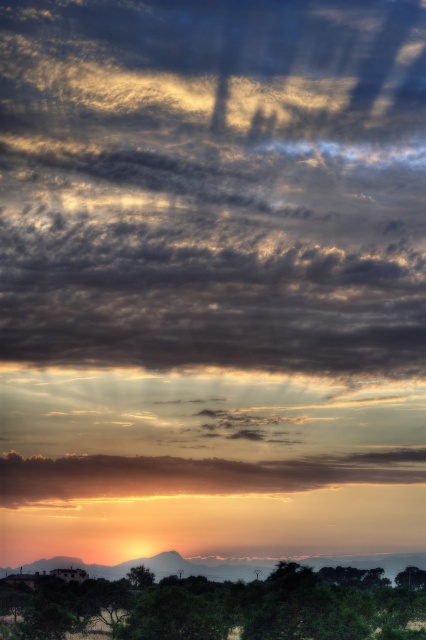
Question: Which object is farther from the camera taking this photo?

Choices:
 (A) golden textured clouds at upper center
 (B) golden matte cloud at lower center

Answer: (B)

Question: Can you confirm if green leafy tree at lower right is positioned to the right of green matte tree at lower center?

Choices:
 (A) no
 (B) yes

Answer: (B)

Question: Does golden matte cloud at lower center have a larger size compared to green matte tree at lower center?

Choices:
 (A) no
 (B) yes

Answer: (B)

Question: Based on their relative distances, which object is farther from the golden matte cloud at lower center?

Choices:
 (A) green leafy tree at lower right
 (B) green matte tree at lower center

Answer: (A)

Question: Which point is closer to the camera?

Choices:
 (A) green matte tree at lower center
 (B) golden textured clouds at upper center
 (C) green leafy tree at lower left

Answer: (C)

Question: Is golden textured clouds at upper center thinner than green leafy tree at lower right?

Choices:
 (A) no
 (B) yes

Answer: (A)